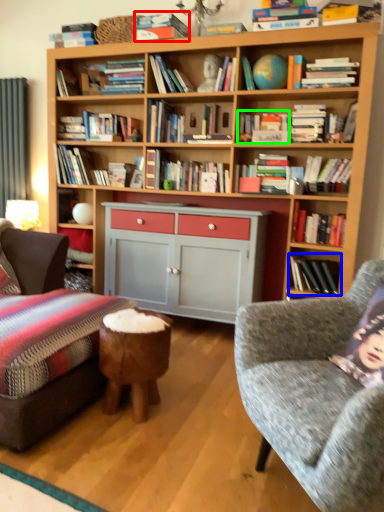
Question: Estimate the real-world distances between objects in this image. Which object is farther from book (highlighted by a red box), book (highlighted by a blue box) or magazine (highlighted by a green box)?

Choices:
 (A) book
 (B) magazine

Answer: (A)